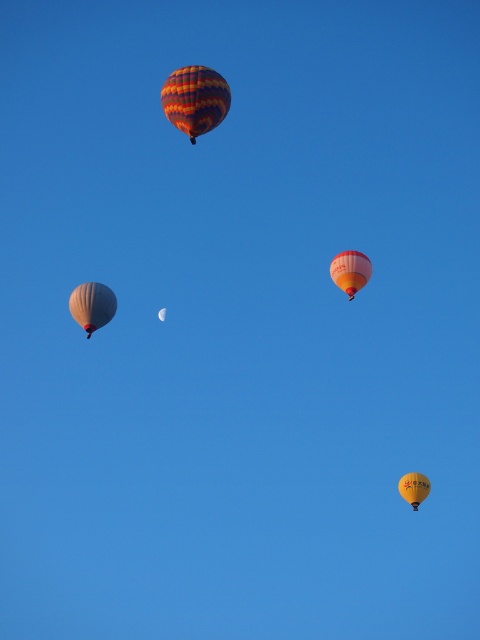
Question: Which point is closer to the camera?

Choices:
 (A) (88, 314)
 (B) (215, 112)
 (C) (348, 256)

Answer: (B)

Question: Does striped fabric hot air balloon at upper center have a lesser width compared to yellow fabric balloon at lower right?

Choices:
 (A) yes
 (B) no

Answer: (B)

Question: Which object is positioned farthest from the matte white hot air balloon at upper left?

Choices:
 (A) orange fabric hot air balloon at upper right
 (B) striped fabric hot air balloon at upper center
 (C) yellow fabric balloon at lower right
 (D) matte white balloon at left

Answer: (B)

Question: Is matte white balloon at left smaller than yellow fabric balloon at lower right?

Choices:
 (A) no
 (B) yes

Answer: (A)

Question: Is the position of striped fabric hot air balloon at upper center more distant than that of yellow fabric balloon at lower right?

Choices:
 (A) no
 (B) yes

Answer: (A)

Question: Which object is farther from the camera taking this photo?

Choices:
 (A) matte white hot air balloon at upper left
 (B) matte white balloon at left
 (C) yellow fabric balloon at lower right

Answer: (A)